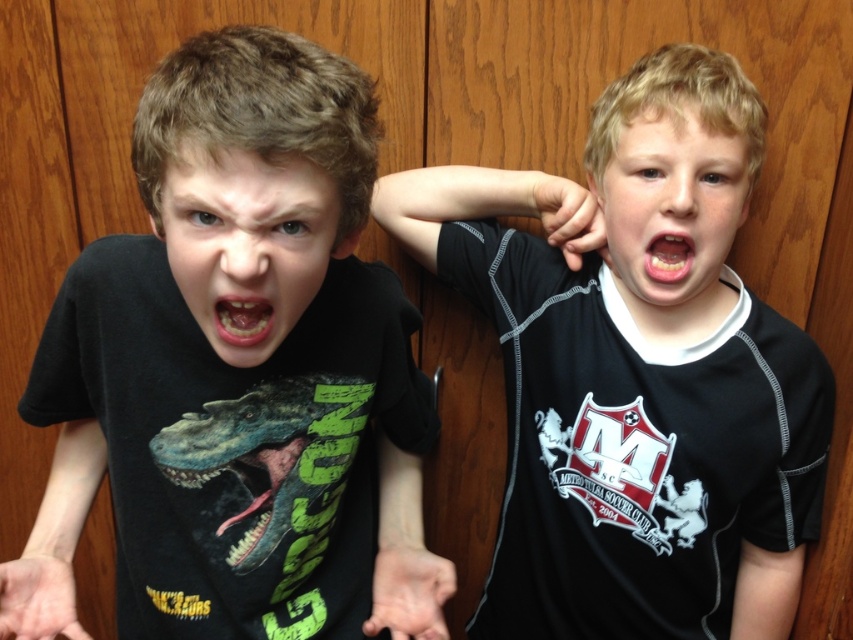
Question: Which point is farther from the camera taking this photo?

Choices:
 (A) (747, 449)
 (B) (241, 483)
 (C) (268, 333)

Answer: (A)

Question: Which of the following is the closest to the observer?

Choices:
 (A) smooth skin face at center
 (B) black matte t-shirt at center
 (C) blonde hair at upper right

Answer: (B)

Question: Where is black matte shirt at center located in relation to teeth at center in the image?

Choices:
 (A) left
 (B) right

Answer: (B)

Question: Which point is closer to the camera taking this photo?

Choices:
 (A) (704, 461)
 (B) (221, 36)

Answer: (B)

Question: Can you confirm if black matte t-shirt at center is positioned to the left of teeth at center?

Choices:
 (A) no
 (B) yes

Answer: (B)

Question: From the image, what is the correct spatial relationship of black matte t-shirt at center in relation to smooth skin face at center?

Choices:
 (A) above
 (B) below

Answer: (B)